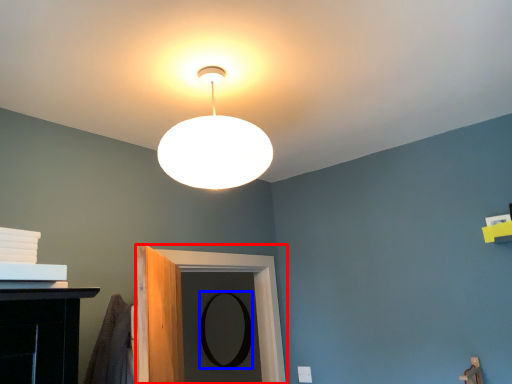
Question: Which point is further to the camera, door (highlighted by a red box) or mirror (highlighted by a blue box)?

Choices:
 (A) door
 (B) mirror

Answer: (B)